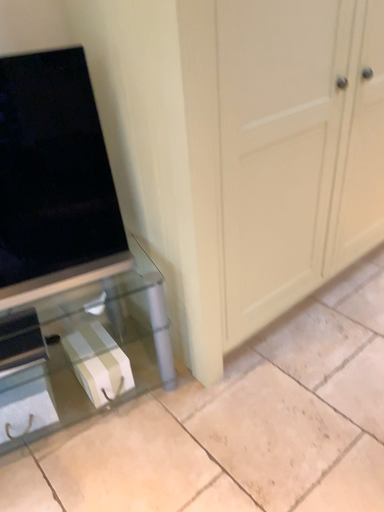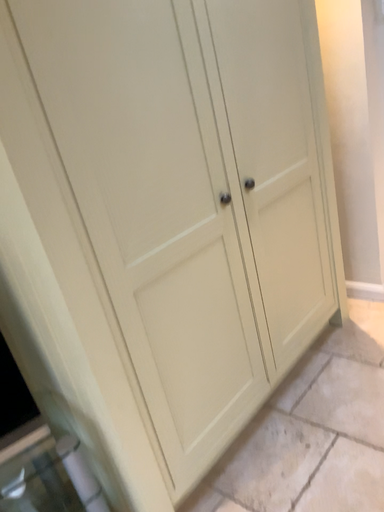
Question: How did the camera likely rotate when shooting the video?

Choices:
 (A) rotated upward
 (B) rotated downward

Answer: (A)